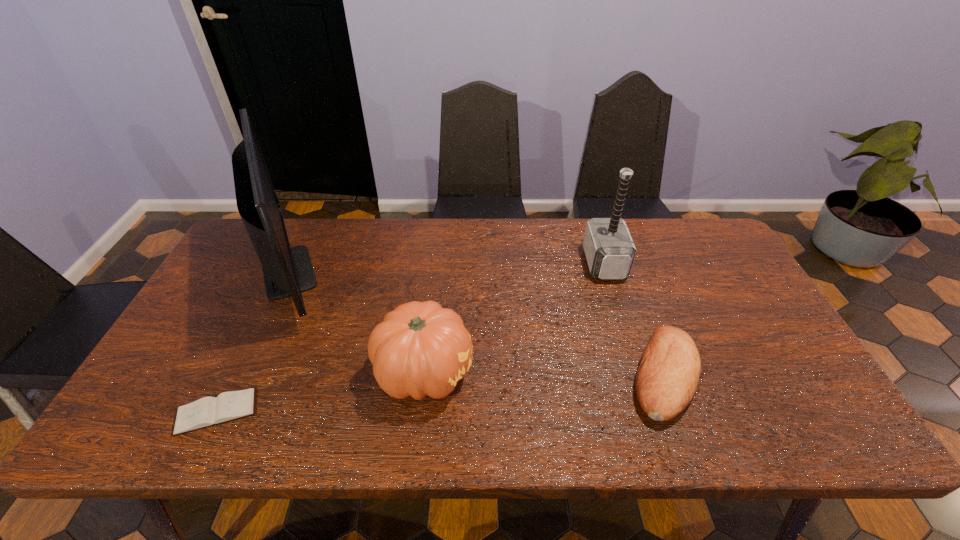
You are a GUI agent. You are given a task and a screenshot of the screen. Output one action in this format:
    pyautogui.click(x=<x>, y=<y>)
    Task: Click on the computer monitor
    The image size is (960, 540).
    Given the screenshot: What is the action you would take?
    pyautogui.click(x=288, y=271)

Where is `hammer`? The height and width of the screenshot is (540, 960). hammer is located at coordinates (610, 251).

Where is `the third shortest object`? Image resolution: width=960 pixels, height=540 pixels. the third shortest object is located at coordinates (420, 348).

This screenshot has width=960, height=540. I want to click on pumpkin, so click(x=420, y=348).

At what (x,y) coordinates should I click in order to perform the action: click on the second shortest object. Please return your answer as a coordinate pair (x, y). The image size is (960, 540). Looking at the image, I should click on 669,369.

Identify the location of the shortest object. (208, 411).

The height and width of the screenshot is (540, 960). Identify the location of free space located 0.080m on the front-facing side of the computer monitor. (361, 271).

Image resolution: width=960 pixels, height=540 pixels. I want to click on free region located for striking with the head of the hammer, so click(570, 263).

Image resolution: width=960 pixels, height=540 pixels. I want to click on blank space located 0.290m for striking with the head of the hammer, so click(x=493, y=263).

Identify the location of blank area located 0.350m for striking with the head of the hammer. (474, 263).